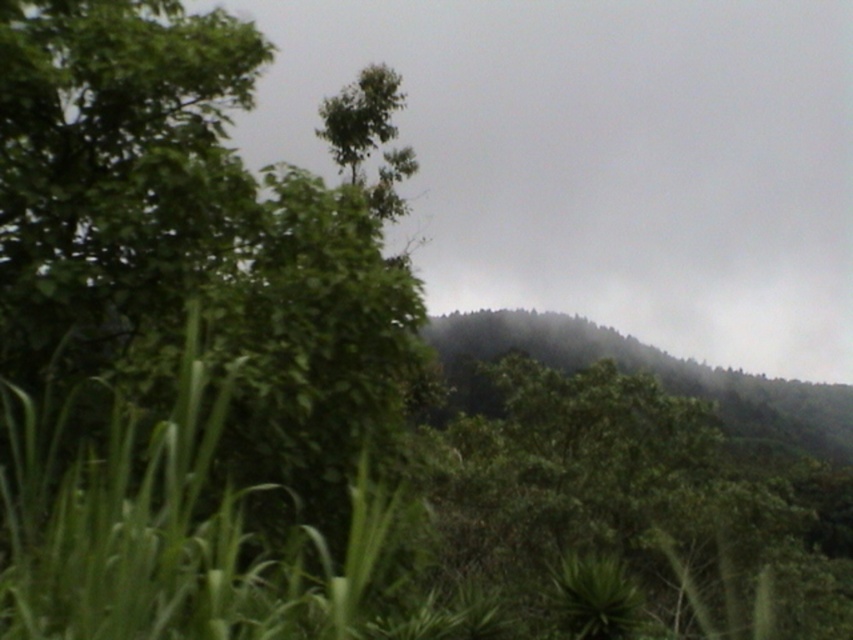
You are standing in a lush green landscape with tall plants in the foreground and a hillside in the midground. You notice a point marked at coordinates (x=604, y=157). What is located at this point?

The point at coordinates (x=604, y=157) marks a green leafy cloud at upper center.

You are a hiker standing at the bottom of the hill. You see the green leafy cloud at upper center and the dark green forest at center. Which object is closer to you?

The green leafy cloud at upper center is closer to you because it is in front of the dark green forest at center.